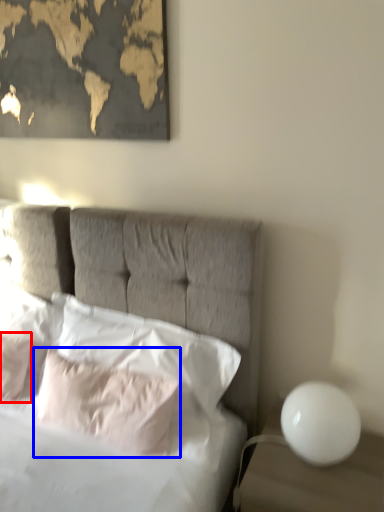
Question: Which of the following is the farthest to the observer, pillow (highlighted by a red box) or pillow (highlighted by a blue box)?

Choices:
 (A) pillow
 (B) pillow

Answer: (A)